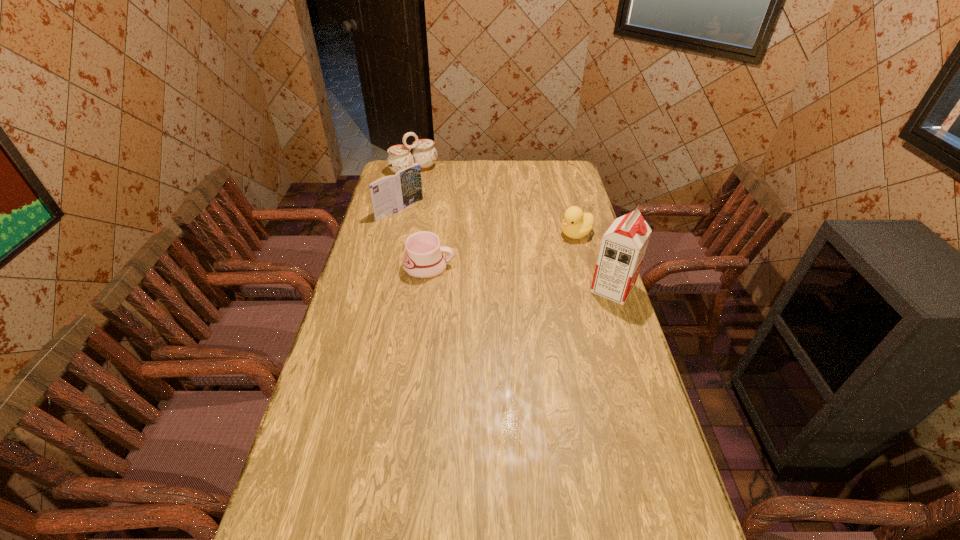
Image resolution: width=960 pixels, height=540 pixels. I want to click on vacant point located between the mug and the fourth tallest object, so [502, 251].

Locate an element on the screen. This screenshot has width=960, height=540. free area in between the second shortest object and the shortest object is located at coordinates (502, 251).

The width and height of the screenshot is (960, 540). Find the location of `unoccupied position between the tallest object and the mug`. unoccupied position between the tallest object and the mug is located at coordinates (x=520, y=278).

Where is `object identified as the third closest to the tallest object`? The width and height of the screenshot is (960, 540). object identified as the third closest to the tallest object is located at coordinates (390, 194).

Select which object appears as the fourth closest to the book. Please provide its 2D coordinates. Your answer should be formatted as a tuple, i.e. [(x, y)], where the tuple contains the x and y coordinates of a point satisfying the conditions above.

[(623, 246)]

The image size is (960, 540). Find the location of `vacant space that satisfies the following two spatial constraints: 1. on the front side of the tallest object; 2. on the right side of the third nearest object`. vacant space that satisfies the following two spatial constraints: 1. on the front side of the tallest object; 2. on the right side of the third nearest object is located at coordinates (591, 288).

Identify the location of free point that satisfies the following two spatial constraints: 1. on the front side of the second shortest object; 2. on the right side of the soya milk. The height and width of the screenshot is (540, 960). (591, 288).

This screenshot has height=540, width=960. I want to click on vacant point that satisfies the following two spatial constraints: 1. on the front side of the third nearest object; 2. on the right side of the farthest object, so click(x=399, y=234).